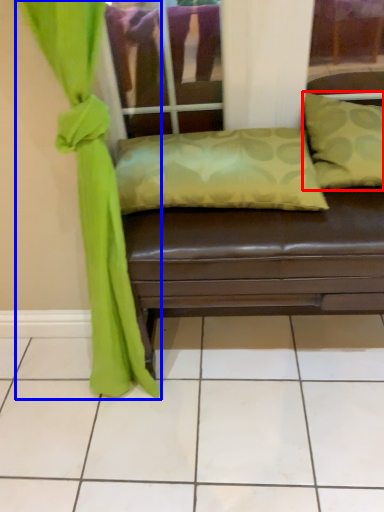
Question: Which object appears closest to the camera in this image, pillow (highlighted by a red box) or curtain (highlighted by a blue box)?

Choices:
 (A) pillow
 (B) curtain

Answer: (B)